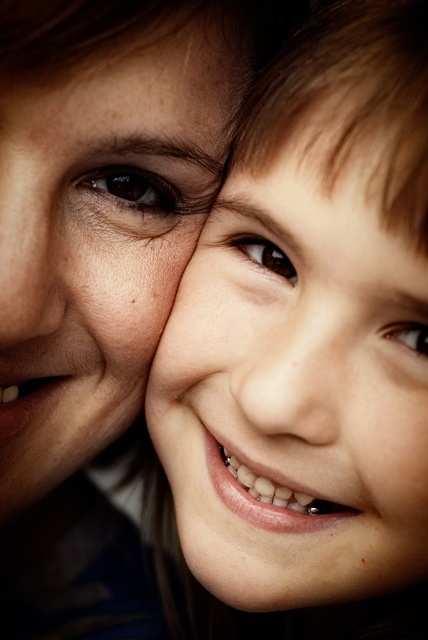
Question: Is smooth skin face at center behind brown glossy eye at center?

Choices:
 (A) yes
 (B) no

Answer: (B)

Question: Does smooth skin face at center appear over brown glossy eye at upper left?

Choices:
 (A) yes
 (B) no

Answer: (B)

Question: Which of the following is the farthest from the observer?

Choices:
 (A) (422, 355)
 (B) (80, 180)
 (C) (240, 403)
 (D) (145, 198)

Answer: (D)

Question: Which point appears closest to the camera in this image?

Choices:
 (A) (246, 72)
 (B) (65, 180)

Answer: (B)

Question: Does smooth skin face at center have a greater width compared to smooth skin nose at upper left?

Choices:
 (A) yes
 (B) no

Answer: (A)

Question: Among these objects, which one is nearest to the camera?

Choices:
 (A) smooth skin face at center
 (B) smooth skin nose at center

Answer: (A)